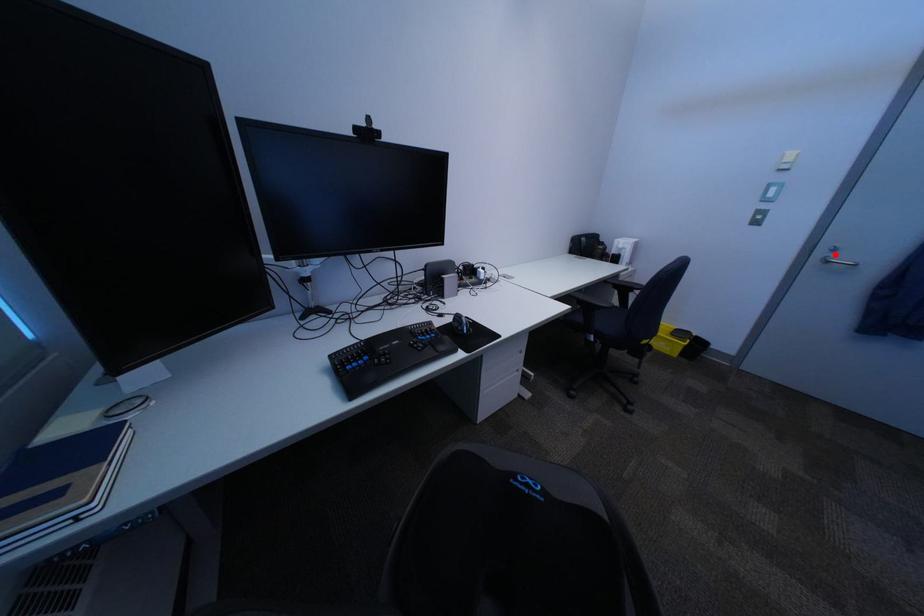
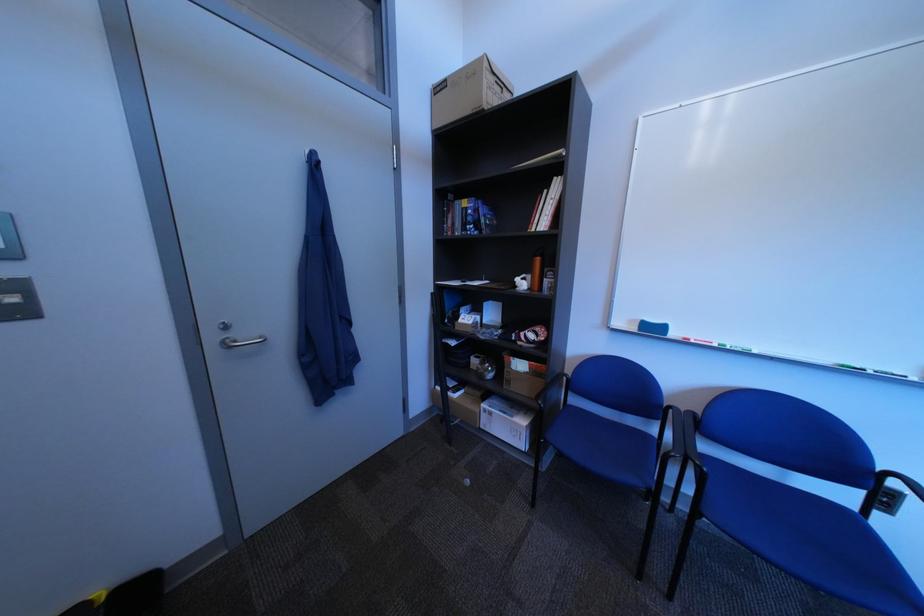
Question: I am providing you with two images of the same scene from different viewpoints. Image1 has a red point marked. In image2, the corresponding 3D location appears at what relative position? Reply with the corresponding letter.

Choices:
 (A) Closer
 (B) Farther

Answer: (A)